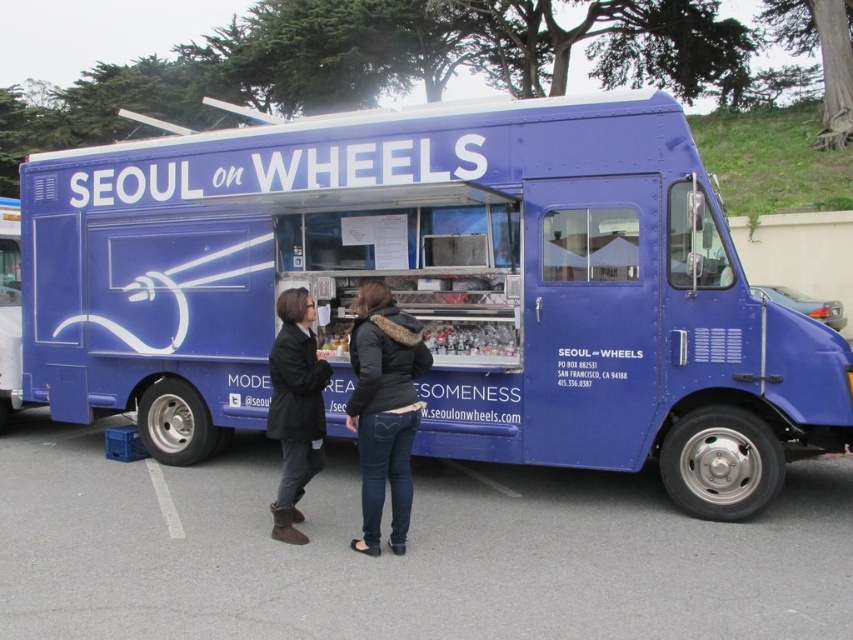
You are standing in front of the blue matte food truck at center. There is a specific point at coordinates point (434,289). Where is this point located?

The point (434,289) is located on the blue matte food truck at center.

You are standing in front of the Seoul on Wheels food truck and notice two points marked on its side. The first point is at coordinate point (695, 554) and the second is at point (311, 332). Which point appears closer to you when looking at the truck?

Point (695, 554) is closer to the camera than point (311, 332), so the first point appears closer to you.

You are a customer standing in front of the blue matte food truck at center and the gray asphalt at lower center. Which surface are you currently standing on?

The gray asphalt at lower center is the surface you are standing on because the blue matte food truck at center is further away from you, meaning the gray asphalt at lower center is closer to your position.